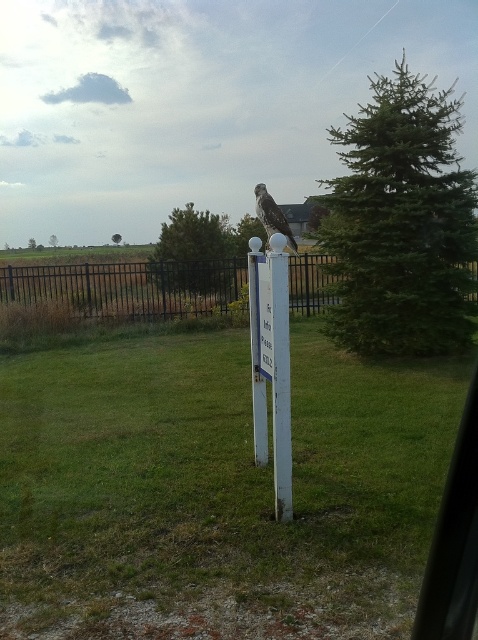
Question: Can you confirm if white plastic pole at center is positioned above brown feathered falcon at center?

Choices:
 (A) no
 (B) yes

Answer: (A)

Question: Which point appears closest to the camera in this image?

Choices:
 (A) (474, 264)
 (B) (278, 429)
 (C) (278, 212)

Answer: (B)

Question: Which point is closer to the camera?

Choices:
 (A) (257, 196)
 (B) (253, 332)
 (C) (473, 301)

Answer: (B)

Question: Is green grass at center further to the viewer compared to white plastic pole at center?

Choices:
 (A) yes
 (B) no

Answer: (B)

Question: Does green grass at center have a larger size compared to brown feathered falcon at center?

Choices:
 (A) no
 (B) yes

Answer: (A)

Question: Which of these objects is positioned farthest from the green grass at center?

Choices:
 (A) black metal fence at left
 (B) brown feathered falcon at center

Answer: (A)